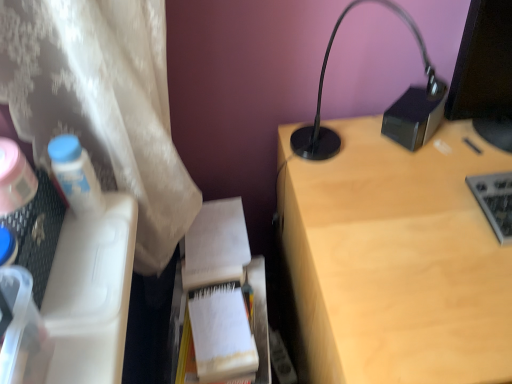
Question: From a real-world perspective, is light wood desk at upper right positioned under gray metallic keyboard at right based on gravity?

Choices:
 (A) no
 (B) yes

Answer: (B)

Question: Can you confirm if light wood desk at upper right is wider than gray metallic keyboard at right?

Choices:
 (A) yes
 (B) no

Answer: (A)

Question: Is light wood desk at upper right to the left of gray metallic keyboard at right from the viewer's perspective?

Choices:
 (A) no
 (B) yes

Answer: (B)

Question: Is light wood desk at upper right placed right next to gray metallic keyboard at right?

Choices:
 (A) no
 (B) yes

Answer: (A)

Question: Is the depth of light wood desk at upper right greater than that of gray metallic keyboard at right?

Choices:
 (A) yes
 (B) no

Answer: (B)

Question: Is point (300, 365) closer or farther from the camera than point (500, 221)?

Choices:
 (A) closer
 (B) farther

Answer: (B)

Question: From the image's perspective, is light wood desk at upper right above or below gray metallic keyboard at right?

Choices:
 (A) above
 (B) below

Answer: (B)

Question: Considering the positions of light wood desk at upper right and gray metallic keyboard at right in the image, is light wood desk at upper right wider or thinner than gray metallic keyboard at right?

Choices:
 (A) wide
 (B) thin

Answer: (A)

Question: In terms of height, does light wood desk at upper right look taller or shorter compared to gray metallic keyboard at right?

Choices:
 (A) tall
 (B) short

Answer: (A)

Question: Relative to white paper at center, is white paper notebook at center in front or behind?

Choices:
 (A) behind
 (B) front

Answer: (A)

Question: From the image's perspective, is white paper notebook at center located above or below white paper at center?

Choices:
 (A) below
 (B) above

Answer: (B)

Question: From a real-world perspective, is white paper notebook at center physically located above or below white paper at center?

Choices:
 (A) above
 (B) below

Answer: (A)

Question: Is white paper notebook at center wider or thinner than white paper at center?

Choices:
 (A) wide
 (B) thin

Answer: (B)

Question: Considering the positions of white paper notebook at center and black glossy monitor at upper right in the image, is white paper notebook at center taller or shorter than black glossy monitor at upper right?

Choices:
 (A) short
 (B) tall

Answer: (A)

Question: In terms of width, does white paper notebook at center look wider or thinner when compared to black glossy monitor at upper right?

Choices:
 (A) wide
 (B) thin

Answer: (A)